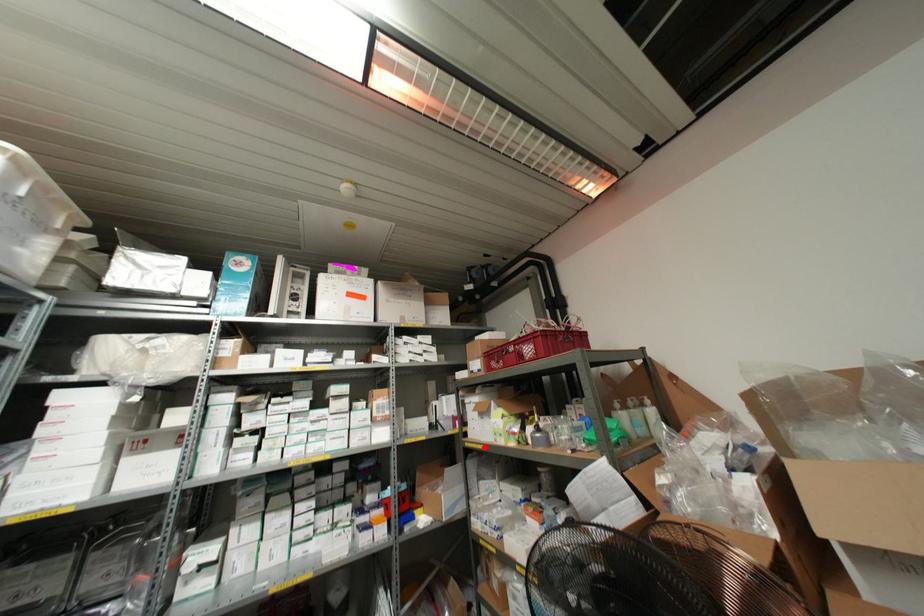
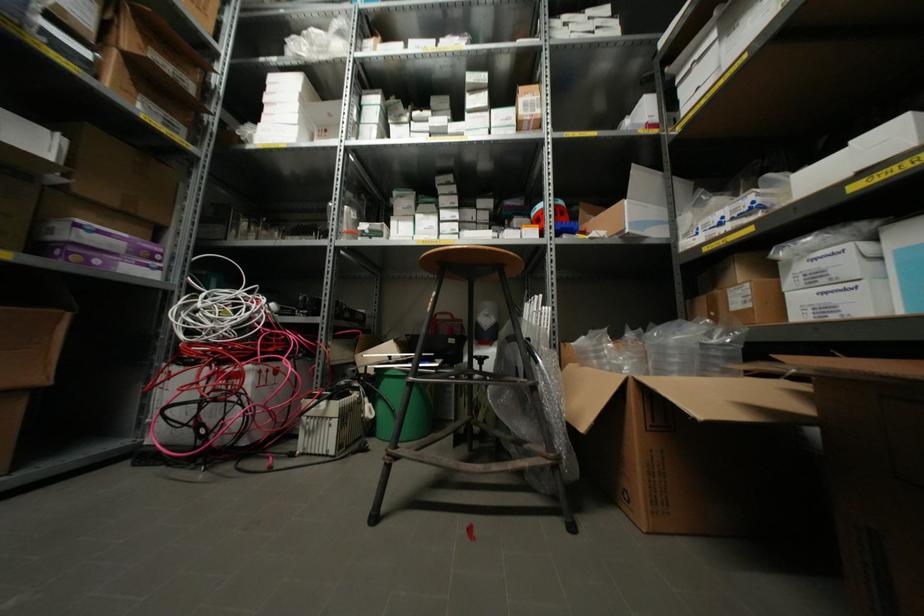
Question: I am providing you with two images of the same scene from different viewpoints. Image1 has a red point marked. In image2, the corresponding 3D location appears at what relative position? Reply with the corresponding letter.

Choices:
 (A) Closer
 (B) Farther

Answer: (A)